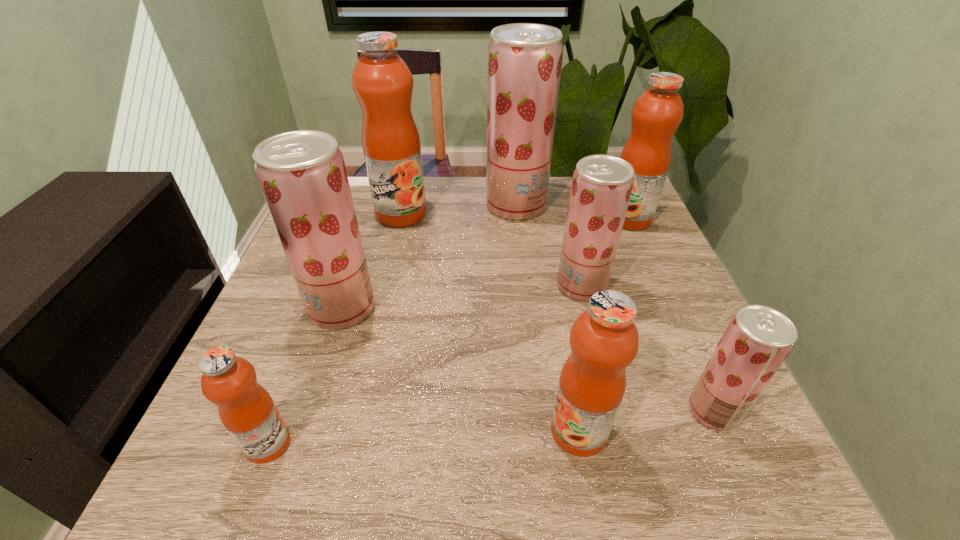
Where is `the farthest strawberry fruit juice`? This screenshot has width=960, height=540. the farthest strawberry fruit juice is located at coordinates (524, 59).

At what (x,y) coordinates should I click in order to perform the action: click on the second orange fruit juice from left to right. Please return your answer as a coordinate pair (x, y). The width and height of the screenshot is (960, 540). Looking at the image, I should click on [x=382, y=82].

The width and height of the screenshot is (960, 540). I want to click on the third smallest strawberry fruit juice, so click(302, 174).

Where is `the rightmost orange fruit juice`? This screenshot has height=540, width=960. the rightmost orange fruit juice is located at coordinates (658, 111).

The width and height of the screenshot is (960, 540). In order to click on the third biggest strawberry fruit juice in this screenshot , I will do `click(601, 188)`.

The image size is (960, 540). Find the location of `the third biggest orange fruit juice`. the third biggest orange fruit juice is located at coordinates (604, 340).

Find the location of a particular element. This screenshot has height=540, width=960. the rightmost strawberry fruit juice is located at coordinates (758, 339).

Find the location of `the smallest strawberry fruit juice`. the smallest strawberry fruit juice is located at coordinates (758, 339).

Where is `the leftmost orange fruit juice`? This screenshot has width=960, height=540. the leftmost orange fruit juice is located at coordinates (246, 409).

This screenshot has height=540, width=960. In order to click on vacant space located on the back of the farthest strawberry fruit juice in this screenshot , I will do `click(513, 178)`.